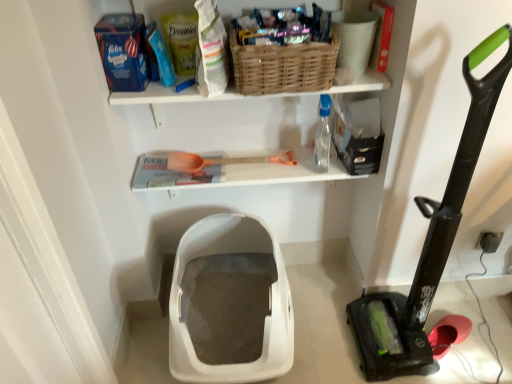
Question: Is black rubber vacuum at right thinner than woven brown basket at upper center?

Choices:
 (A) yes
 (B) no

Answer: (B)

Question: Is woven brown basket at upper center at the back of black rubber vacuum at right?

Choices:
 (A) no
 (B) yes

Answer: (A)

Question: From a real-world perspective, is black rubber vacuum at right located higher than woven brown basket at upper center?

Choices:
 (A) no
 (B) yes

Answer: (A)

Question: Can you confirm if black rubber vacuum at right is smaller than woven brown basket at upper center?

Choices:
 (A) no
 (B) yes

Answer: (A)

Question: Can we say black rubber vacuum at right lies outside woven brown basket at upper center?

Choices:
 (A) yes
 (B) no

Answer: (A)

Question: Is black rubber vacuum at right facing towards woven brown basket at upper center?

Choices:
 (A) no
 (B) yes

Answer: (A)

Question: Can you confirm if black rubber vacuum at right is smaller than orange plastic shovel at center?

Choices:
 (A) yes
 (B) no

Answer: (B)

Question: Considering the relative sizes of black rubber vacuum at right and orange plastic shovel at center in the image provided, is black rubber vacuum at right bigger than orange plastic shovel at center?

Choices:
 (A) no
 (B) yes

Answer: (B)

Question: Is black rubber vacuum at right positioned with its back to orange plastic shovel at center?

Choices:
 (A) yes
 (B) no

Answer: (B)

Question: From a real-world perspective, is black rubber vacuum at right located higher than orange plastic shovel at center?

Choices:
 (A) no
 (B) yes

Answer: (A)

Question: Does black rubber vacuum at right have a lesser height compared to orange plastic shovel at center?

Choices:
 (A) no
 (B) yes

Answer: (A)

Question: Is black rubber vacuum at right wider than orange plastic shovel at center?

Choices:
 (A) no
 (B) yes

Answer: (B)

Question: From a real-world perspective, is woven brown basket at upper center physically above black rubber vacuum at right?

Choices:
 (A) no
 (B) yes

Answer: (B)